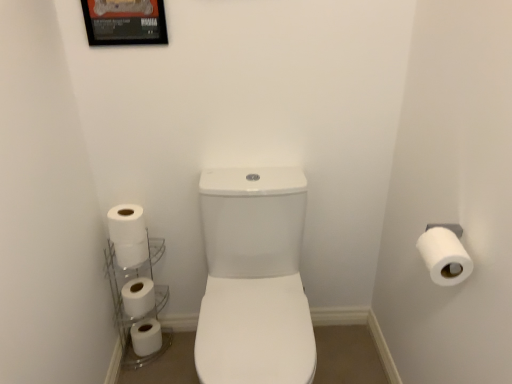
This screenshot has width=512, height=384. What are the coordinates of `empty space that is to the right of white matte toilet paper at lower left, the fifth toilet paper viewed from the top` in the screenshot? It's located at (177, 347).